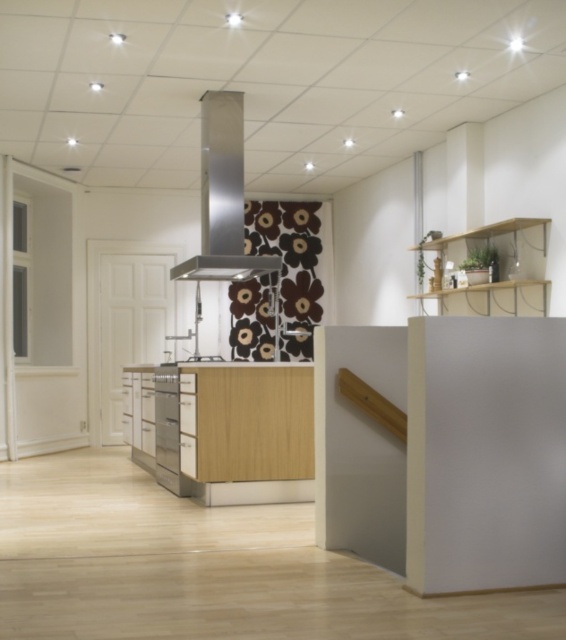
Can you confirm if stainless steel exhaust hood at center is shorter than satin silver oven at center?

Incorrect, stainless steel exhaust hood at center's height does not fall short of satin silver oven at center's.

This screenshot has height=640, width=566. Describe the element at coordinates (222, 196) in the screenshot. I see `stainless steel exhaust hood at center` at that location.

This screenshot has height=640, width=566. I want to click on stainless steel exhaust hood at center, so click(222, 196).